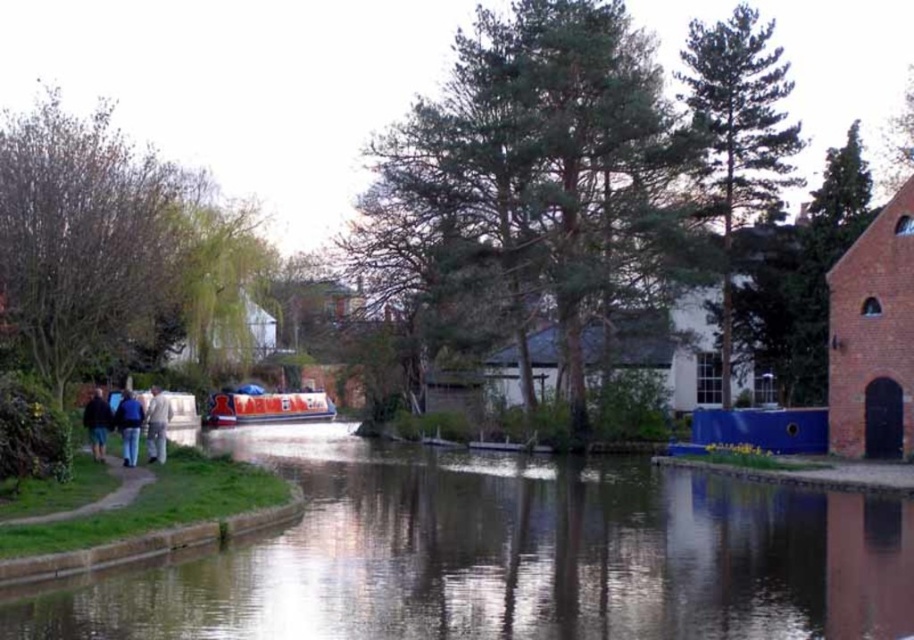
Measure the distance from smooth reflective water at center to light blue jeans at center.

42.01 feet

Is smooth reflective water at center closer to the viewer compared to light blue jeans at center?

Yes, smooth reflective water at center is closer to the viewer.

Who is more forward, (538,632) or (160,432)?

Point (538,632) is in front.

Where is `smooth reflective water at center`? The height and width of the screenshot is (640, 914). smooth reflective water at center is located at coordinates (509, 556).

Can you confirm if smooth reflective water at center is positioned below blue jeans at lower left?

Indeed, smooth reflective water at center is positioned under blue jeans at lower left.

This screenshot has height=640, width=914. What do you see at coordinates (509, 556) in the screenshot?
I see `smooth reflective water at center` at bounding box center [509, 556].

What are the coordinates of `smooth reflective water at center` in the screenshot? It's located at (509, 556).

Which is below, white glossy canal boat at center or white cotton pants at left?

white glossy canal boat at center is lower down.

Is the position of white glossy canal boat at center more distant than that of white cotton pants at left?

Yes, white glossy canal boat at center is behind white cotton pants at left.

Where is `white glossy canal boat at center`? The height and width of the screenshot is (640, 914). white glossy canal boat at center is located at coordinates pos(266,406).